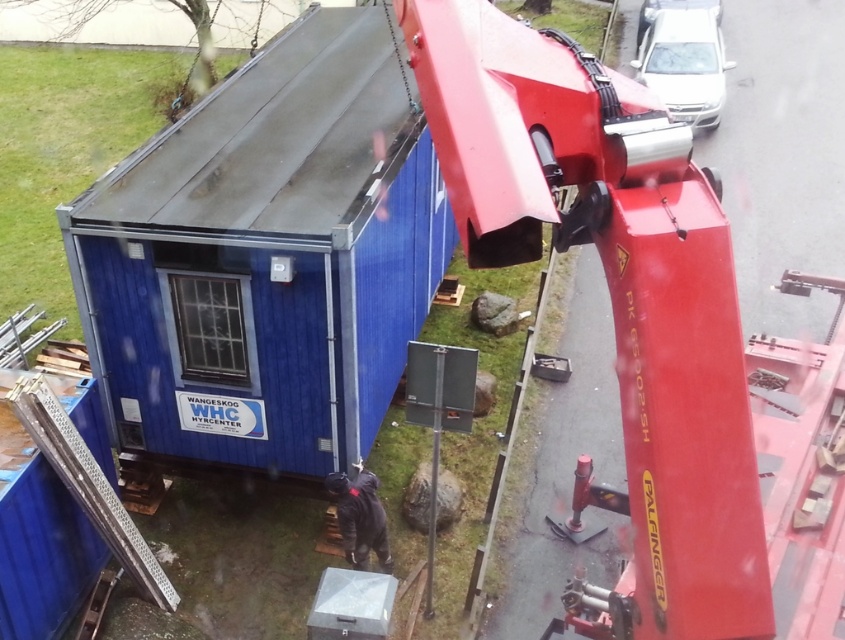
Is white glossy car at upper right to the right of dark gray fabric jacket at lower center from the viewer's perspective?

Yes, white glossy car at upper right is to the right of dark gray fabric jacket at lower center.

Who is more distant from viewer, (707, 44) or (344, 493)?

The point (707, 44) is behind.

The height and width of the screenshot is (640, 845). Describe the element at coordinates (685, 65) in the screenshot. I see `white glossy car at upper right` at that location.

Locate an element on the screen. white glossy car at upper right is located at coordinates (685, 65).

Which is in front, point (489, 124) or point (350, 480)?

Point (489, 124) is more forward.

Does metallic red crane arm at upper right have a larger size compared to dark gray fabric jacket at lower center?

Indeed, metallic red crane arm at upper right has a larger size compared to dark gray fabric jacket at lower center.

Is point (603, 182) closer to camera compared to point (353, 500)?

Yes.

Identify the location of metallic red crane arm at upper right. Image resolution: width=845 pixels, height=640 pixels. (641, 321).

Who is higher up, blue metallic shed at center or dark gray fabric jacket at lower center?

blue metallic shed at center is above.

Looking at this image, does blue metallic shed at center appear on the left side of dark gray fabric jacket at lower center?

Indeed, blue metallic shed at center is positioned on the left side of dark gray fabric jacket at lower center.

Locate an element on the screen. This screenshot has height=640, width=845. blue metallic shed at center is located at coordinates (266, 259).